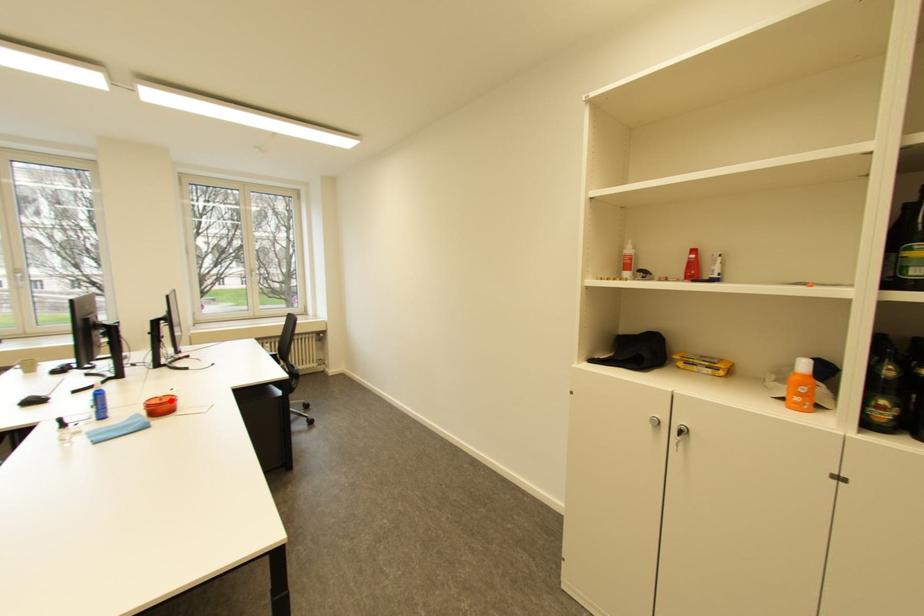
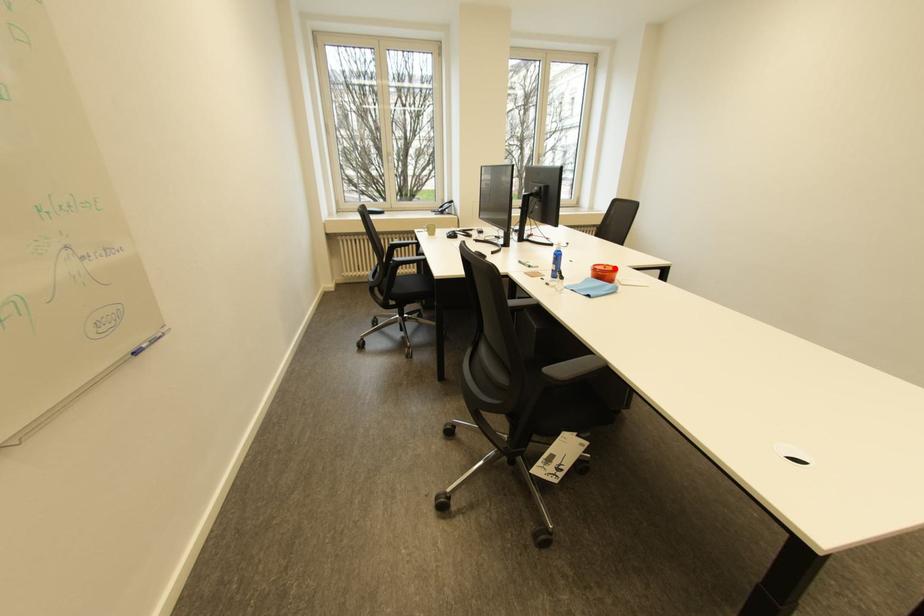
I am providing you with two images of the same scene from different viewpoints. A red point is marked on the first image and another point is marked on the second image. Does the point marked in image1 correspond to the same location as the one in image2?

Yes